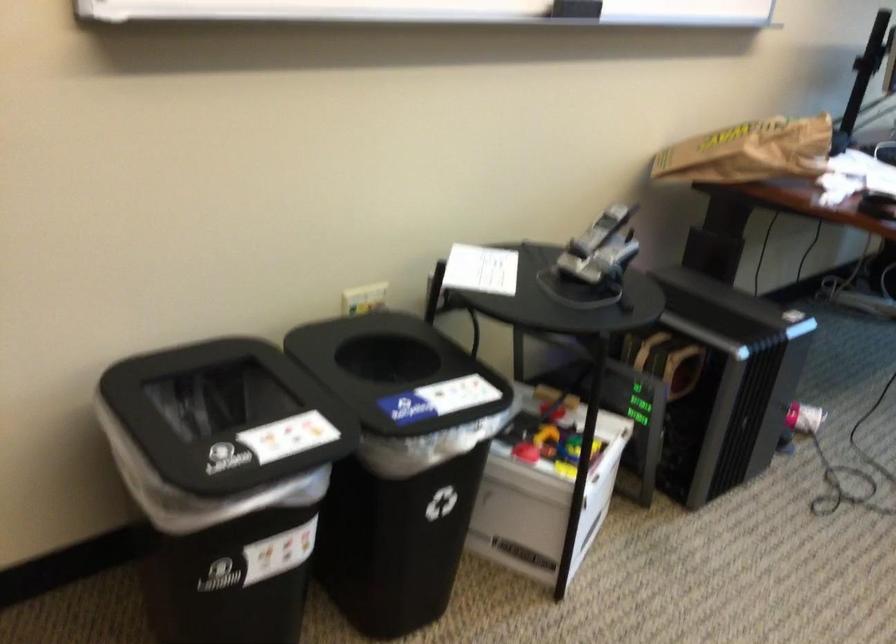
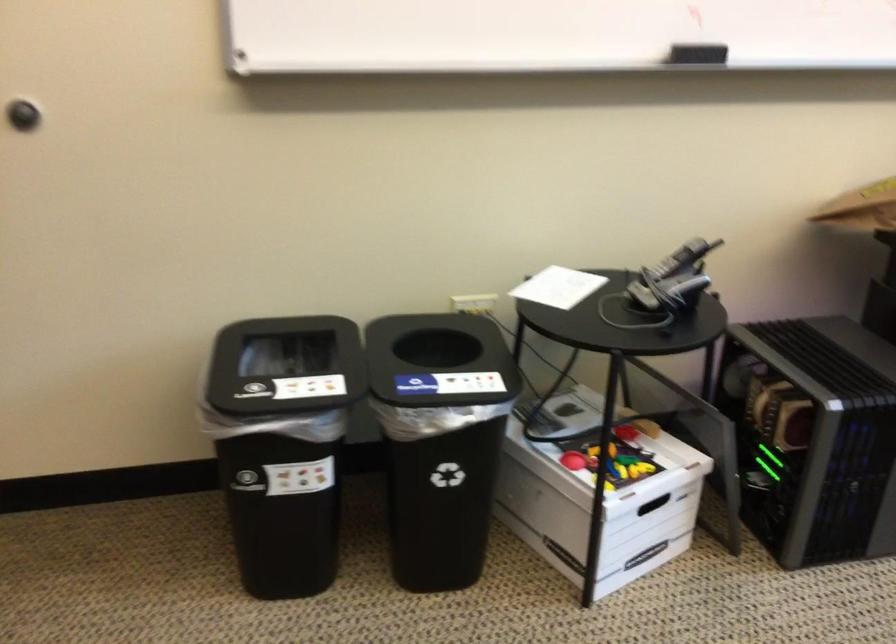
Find the pixel in the second image that matches point (481, 270) in the first image.

(558, 287)